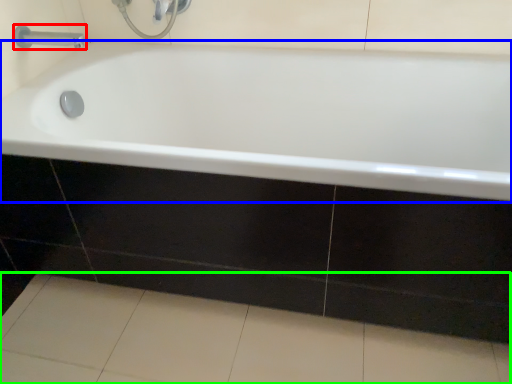
Question: Considering the real-world distances, which object is closest to tap (highlighted by a red box)? bathtub (highlighted by a blue box) or ceramic tile (highlighted by a green box).

Choices:
 (A) bathtub
 (B) ceramic tile

Answer: (A)